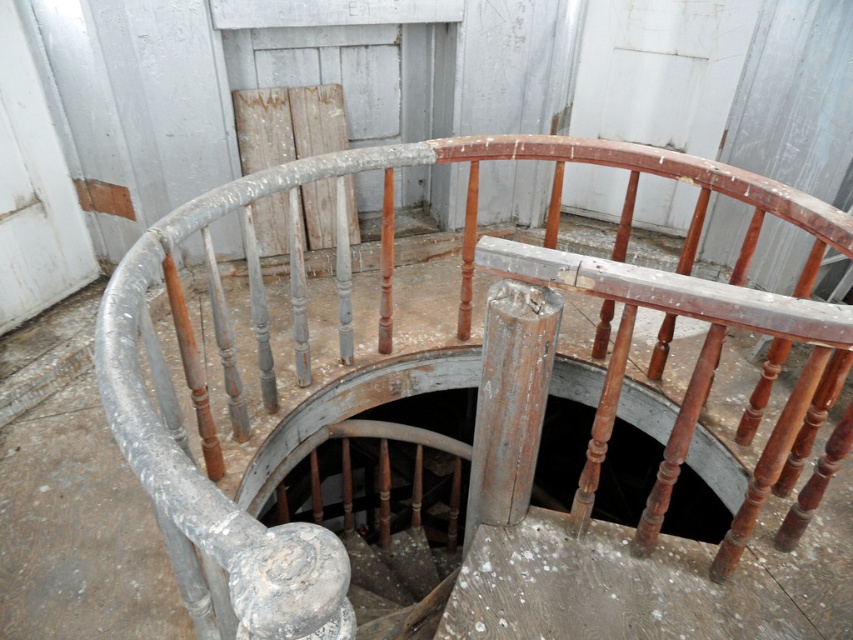
You are a maintenance worker assessing the safety of the spiral staircase. You notice the rusty wood railing at center and the dark wood hole at center. Which object is bigger in size?

The rusty wood railing at center is larger in size than the dark wood hole at center.

Consider the image. You are standing at the base of the spiral staircase and want to place a small potted plant between the rusty wood railing at center and the dark wood hole at center. Which object should you place it closer to to ensure it doesn not block the path between them?

You should place the small potted plant closer to the rusty wood railing at center because it is to the left of the dark wood hole at center, so placing it near the railing would keep it out of the main path between them.

You are a painter standing at the base of the spiral staircase. You need to paint the rusty wood railing at center and the dark wood hole at center. Which object should you paint first based on their vertical positions?

The rusty wood railing at center has a greater height compared to the dark wood hole at center, so you should paint the rusty wood railing at center first as it is higher up.